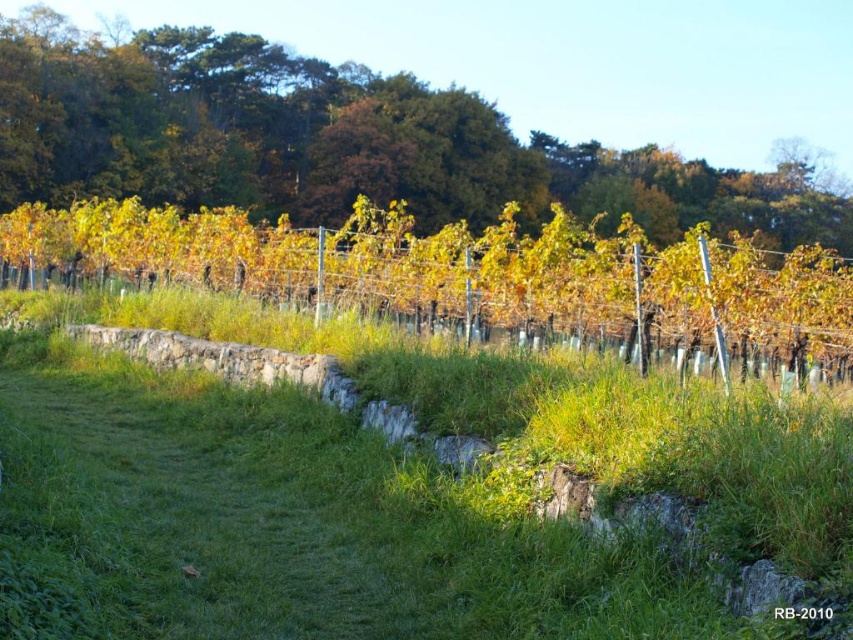
Question: Which point is closer to the camera?

Choices:
 (A) (119, 76)
 (B) (753, 424)

Answer: (B)

Question: Is green grass at center smaller than green leafy tree at upper center?

Choices:
 (A) yes
 (B) no

Answer: (A)

Question: Which of the following is the closest to the observer?

Choices:
 (A) green grass at center
 (B) green leafy tree at upper center

Answer: (A)

Question: Where is green grass at center located in relation to green leafy tree at upper center in the image?

Choices:
 (A) above
 (B) below

Answer: (B)

Question: Can you confirm if green grass at center is positioned to the right of green leafy tree at upper center?

Choices:
 (A) yes
 (B) no

Answer: (B)